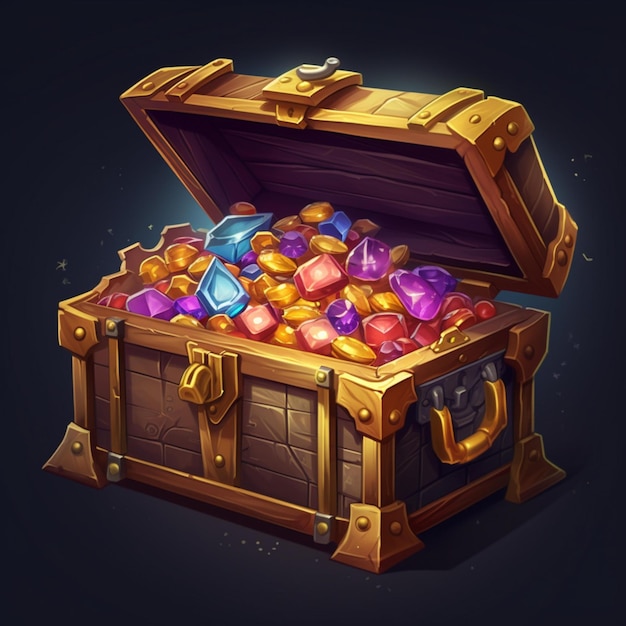
This screenshot has width=626, height=626. What are the coordinates of `slat` in the screenshot? It's located at (228, 505), (449, 510), (510, 200).